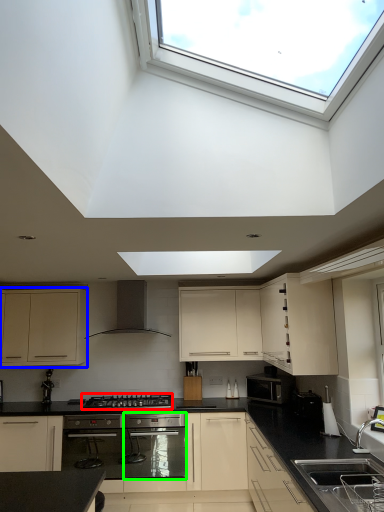
Question: Which object is positioned farthest from gas stove (highlighted by a red box)? Select from cabinetry (highlighted by a blue box) and oven (highlighted by a green box).

Choices:
 (A) cabinetry
 (B) oven

Answer: (A)